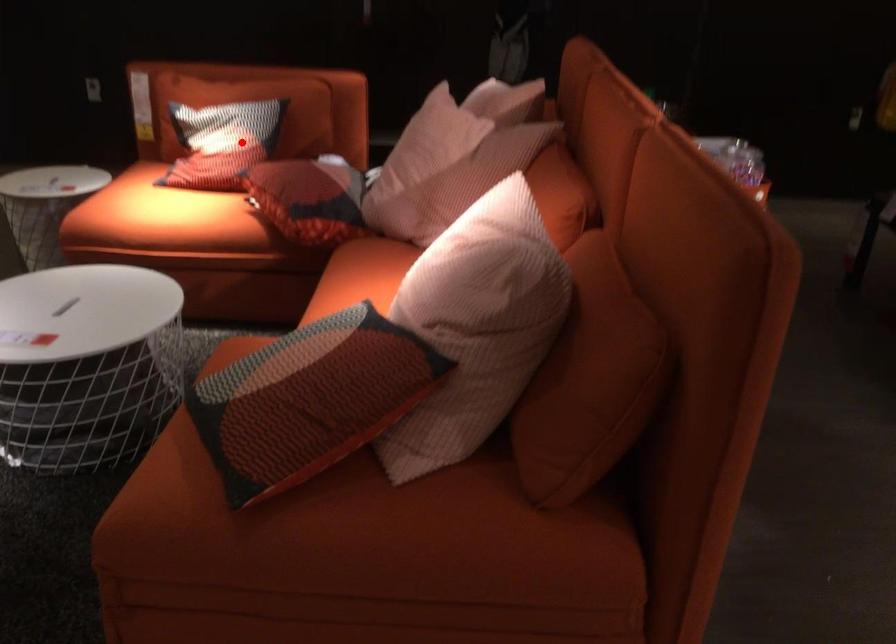
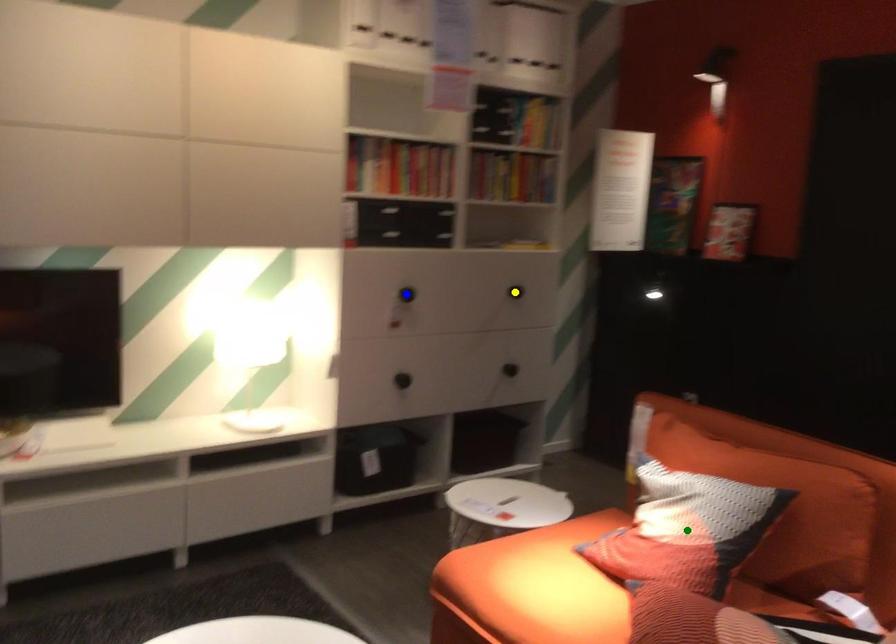
Question: I am providing you with two images of the same scene from different viewpoints. A red point is marked on the first image. You are given multiple points on the second image. Which point in image 2 is actually the same real-world point as the red point in image 1?

Choices:
 (A) blue point
 (B) green point
 (C) yellow point

Answer: (B)